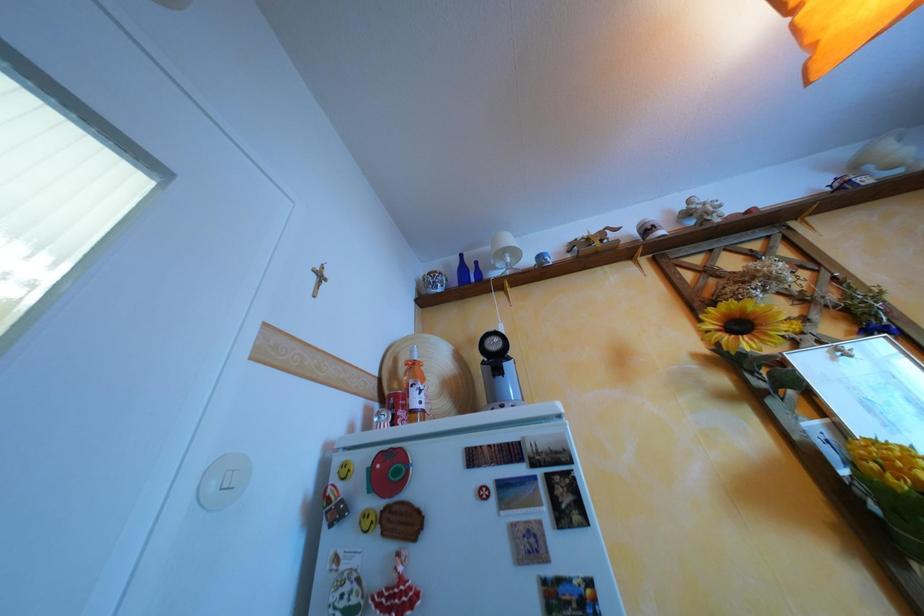
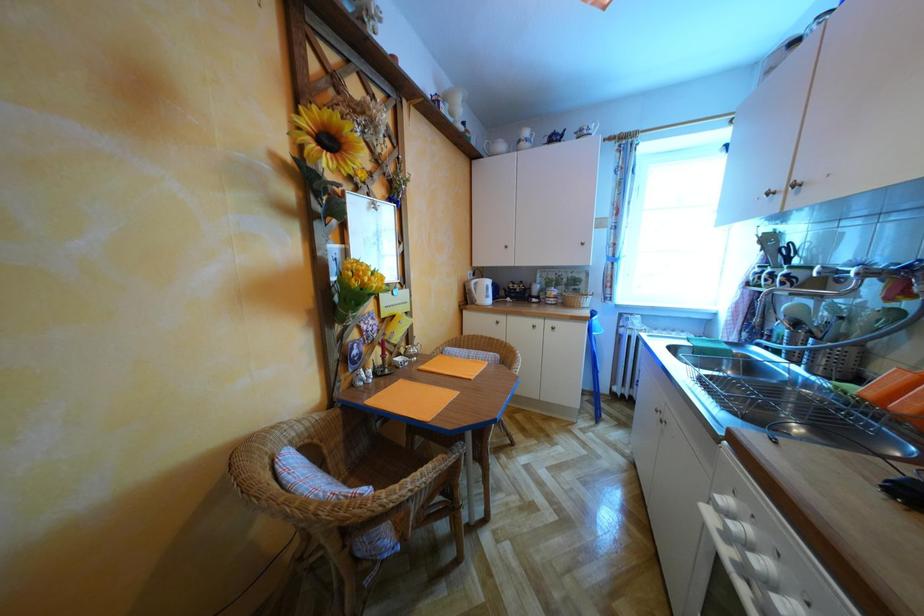
Question: Based on the continuous images, in which direction is the camera rotating? Reply with the corresponding letter.

Choices:
 (A) Left
 (B) Right
 (C) Up
 (D) Down

Answer: (B)